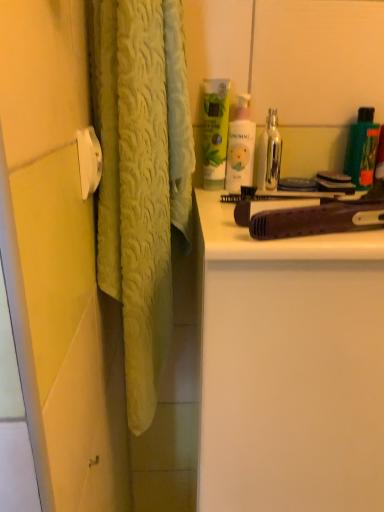
Image resolution: width=384 pixels, height=512 pixels. What do you see at coordinates (276, 240) in the screenshot? I see `brown wood comb at upper right` at bounding box center [276, 240].

This screenshot has width=384, height=512. Describe the element at coordinates (368, 156) in the screenshot. I see `green plastic bottle at upper right, arranged as the 1th toiletry when viewed from the right` at that location.

Measure the distance between green matte bottle at upper right, which ranks as the 2th mouthwash in left-to-right order, and camera.

A distance of 28.73 inches exists between green matte bottle at upper right, which ranks as the 2th mouthwash in left-to-right order, and camera.

What is the approximate height of green matte bottle at upper right, which ranks as the 2th mouthwash in left-to-right order?

green matte bottle at upper right, which ranks as the 2th mouthwash in left-to-right order, is 6.19 inches tall.

In order to face pink matte lotion at upper center, marked as the first toiletry in a left-to-right arrangement, should I rotate leftwards or rightwards?

To face it directly, rotate right by 6.670 degrees.

This screenshot has width=384, height=512. I want to click on metallic silver mouthwash at upper right, arranged as the 1th mouthwash when viewed from the left, so click(x=269, y=154).

This screenshot has height=512, width=384. Identify the location of brown wood comb at upper right. [x=276, y=240].

Is metallic silver mouthwash at upper right, marked as the 2th mouthwash in a right-to-left arrangement, positioned beyond the bounds of green matte bottle at upper right, the first mouthwash when ordered from right to left?

Absolutely, metallic silver mouthwash at upper right, marked as the 2th mouthwash in a right-to-left arrangement, is external to green matte bottle at upper right, the first mouthwash when ordered from right to left.

Find the location of a particular element. mouthwash below the green matte bottle at upper right, which ranks as the 2th mouthwash in left-to-right order (from the image's perspective) is located at coordinates (269, 154).

Consider the image. Is the surface of metallic silver mouthwash at upper right, arranged as the 1th mouthwash when viewed from the left, in direct contact with green matte bottle at upper right, the first mouthwash when ordered from right to left?

No, metallic silver mouthwash at upper right, arranged as the 1th mouthwash when viewed from the left, is not making contact with green matte bottle at upper right, the first mouthwash when ordered from right to left.

Between metallic silver mouthwash at upper right, arranged as the 1th mouthwash when viewed from the left, and green matte bottle at upper right, the first mouthwash when ordered from right to left, which one has more height?

Standing taller between the two is green matte bottle at upper right, the first mouthwash when ordered from right to left.

From the image's perspective, does green plastic bottle at upper right, arranged as the 1th toiletry when viewed from the right, appear lower than green matte bottle at upper right, which ranks as the 2th mouthwash in left-to-right order?

Yes, from the image's perspective, green plastic bottle at upper right, arranged as the 1th toiletry when viewed from the right, is beneath green matte bottle at upper right, which ranks as the 2th mouthwash in left-to-right order.

Which object is positioned more to the right, green plastic bottle at upper right, the second toiletry viewed from the left, or green matte bottle at upper right, which ranks as the 2th mouthwash in left-to-right order?

green plastic bottle at upper right, the second toiletry viewed from the left, is more to the right.

The image size is (384, 512). Find the location of `toiletry below the green matte bottle at upper right, which ranks as the 2th mouthwash in left-to-right order (from a real-world perspective)`. toiletry below the green matte bottle at upper right, which ranks as the 2th mouthwash in left-to-right order (from a real-world perspective) is located at coordinates (368, 156).

Is brown wood comb at upper right not close to green matte lotion at upper center?

Actually, brown wood comb at upper right and green matte lotion at upper center are a little close together.

Which object is closer to the camera, brown wood comb at upper right or green matte lotion at upper center?

brown wood comb at upper right.

Is point (336, 257) less distant than point (204, 93)?

Yes, it is.

Considering the relative sizes of brown wood comb at upper right and green matte lotion at upper center in the image provided, is brown wood comb at upper right shorter than green matte lotion at upper center?

Indeed, brown wood comb at upper right has a lesser height compared to green matte lotion at upper center.

Based on the photo, is pink matte lotion at upper center, marked as the first toiletry in a left-to-right arrangement, surrounded by white matte cabinet at right?

No, pink matte lotion at upper center, marked as the first toiletry in a left-to-right arrangement, is not surrounded by white matte cabinet at right.

Is white matte cabinet at right taller than pink matte lotion at upper center, marked as the first toiletry in a left-to-right arrangement?

Result: Yes.

Could you tell me if white matte cabinet at right is turned towards pink matte lotion at upper center, which ranks as the second toiletry in right-to-left order?

No, white matte cabinet at right does not turn towards pink matte lotion at upper center, which ranks as the second toiletry in right-to-left order.

Looking at the image, does white matte cabinet at right seem bigger or smaller compared to pink matte lotion at upper center, which ranks as the second toiletry in right-to-left order?

Considering their sizes, white matte cabinet at right takes up more space than pink matte lotion at upper center, which ranks as the second toiletry in right-to-left order.

Would you consider brown wood comb at upper right to be distant from green plastic bottle at upper right, the second toiletry viewed from the left?

No.

Is brown wood comb at upper right oriented away from green plastic bottle at upper right, the second toiletry viewed from the left?

Yes, brown wood comb at upper right is facing away from green plastic bottle at upper right, the second toiletry viewed from the left.

How different are the orientations of brown wood comb at upper right and green plastic bottle at upper right, the second toiletry viewed from the left, in degrees?

There is a 2.06e-05-degree angle between the facing directions of brown wood comb at upper right and green plastic bottle at upper right, the second toiletry viewed from the left.

Can you confirm if brown wood comb at upper right is positioned to the right of green plastic bottle at upper right, arranged as the 1th toiletry when viewed from the right?

No, brown wood comb at upper right is not to the right of green plastic bottle at upper right, arranged as the 1th toiletry when viewed from the right.

Can green matte bottle at upper right, the first mouthwash when ordered from right to left, be found inside white matte cabinet at right?

Actually, green matte bottle at upper right, the first mouthwash when ordered from right to left, is outside white matte cabinet at right.

Is white matte cabinet at right behind green matte bottle at upper right, the first mouthwash when ordered from right to left?

That is False.

Are white matte cabinet at right and green matte bottle at upper right, the first mouthwash when ordered from right to left, located far from each other?

No.

Find the location of `the 2nd mouthwash behind the white matte cabinet at right, starting your count from the anchor`. the 2nd mouthwash behind the white matte cabinet at right, starting your count from the anchor is located at coordinates (362, 149).

Can you confirm if white matte cabinet at right is thinner than metallic silver mouthwash at upper right, marked as the 2th mouthwash in a right-to-left arrangement?

In fact, white matte cabinet at right might be wider than metallic silver mouthwash at upper right, marked as the 2th mouthwash in a right-to-left arrangement.

Is white matte cabinet at right shorter than metallic silver mouthwash at upper right, arranged as the 1th mouthwash when viewed from the left?

Incorrect, the height of white matte cabinet at right does not fall short of that of metallic silver mouthwash at upper right, arranged as the 1th mouthwash when viewed from the left.

From the image's perspective, which one is positioned higher, white matte cabinet at right or metallic silver mouthwash at upper right, marked as the 2th mouthwash in a right-to-left arrangement?

metallic silver mouthwash at upper right, marked as the 2th mouthwash in a right-to-left arrangement, is shown above in the image.

Could you tell me if white matte cabinet at right is turned towards metallic silver mouthwash at upper right, marked as the 2th mouthwash in a right-to-left arrangement?

No, white matte cabinet at right is not facing towards metallic silver mouthwash at upper right, marked as the 2th mouthwash in a right-to-left arrangement.

The height and width of the screenshot is (512, 384). I want to click on mouthwash located above the metallic silver mouthwash at upper right, marked as the 2th mouthwash in a right-to-left arrangement (from the image's perspective), so click(362, 149).

Locate an element on the screen. toiletry located below the green matte bottle at upper right, which ranks as the 2th mouthwash in left-to-right order (from the image's perspective) is located at coordinates (368, 156).

Looking at the image, which one is located closer to green matte lotion at upper center, green matte bottle at upper right, the first mouthwash when ordered from right to left, or brown wood comb at upper right?

brown wood comb at upper right lies closer to green matte lotion at upper center than the other object.

Based on their spatial positions, is metallic silver mouthwash at upper right, arranged as the 1th mouthwash when viewed from the left, or green matte lotion at upper center closer to green plastic bottle at upper right, arranged as the 1th toiletry when viewed from the right?

Among the two, metallic silver mouthwash at upper right, arranged as the 1th mouthwash when viewed from the left, is located nearer to green plastic bottle at upper right, arranged as the 1th toiletry when viewed from the right.

Which object lies nearer to the anchor point pink matte lotion at upper center, which ranks as the second toiletry in right-to-left order, green matte lotion at upper center or green matte bottle at upper right, which ranks as the 2th mouthwash in left-to-right order?

Among the two, green matte lotion at upper center is located nearer to pink matte lotion at upper center, which ranks as the second toiletry in right-to-left order.

Estimate the real-world distances between objects in this image. Which object is further from green plastic bottle at upper right, arranged as the 1th toiletry when viewed from the right, white matte cabinet at right or green matte bottle at upper right, the first mouthwash when ordered from right to left?

white matte cabinet at right lies further to green plastic bottle at upper right, arranged as the 1th toiletry when viewed from the right, than the other object.

Considering their positions, is metallic silver mouthwash at upper right, arranged as the 1th mouthwash when viewed from the left, positioned closer to brown wood comb at upper right than white matte cabinet at right?

white matte cabinet at right.

Considering their positions, is green matte bottle at upper right, the first mouthwash when ordered from right to left, positioned closer to brown wood comb at upper right than white matte cabinet at right?

white matte cabinet at right lies closer to brown wood comb at upper right than the other object.

When comparing their distances from metallic silver mouthwash at upper right, arranged as the 1th mouthwash when viewed from the left, does white matte cabinet at right or green matte lotion at upper center seem further?

Based on the image, white matte cabinet at right appears to be further to metallic silver mouthwash at upper right, arranged as the 1th mouthwash when viewed from the left.

In the scene shown: Considering their positions, is metallic silver mouthwash at upper right, marked as the 2th mouthwash in a right-to-left arrangement, positioned further to green matte lotion at upper center than pink matte lotion at upper center, which ranks as the second toiletry in right-to-left order?

Based on the image, metallic silver mouthwash at upper right, marked as the 2th mouthwash in a right-to-left arrangement, appears to be further to green matte lotion at upper center.

Where is `mouthwash between green matte lotion at upper center and green matte bottle at upper right, which ranks as the 2th mouthwash in left-to-right order`? mouthwash between green matte lotion at upper center and green matte bottle at upper right, which ranks as the 2th mouthwash in left-to-right order is located at coordinates (269, 154).

At what (x,y) coordinates should I click in order to perform the action: click on toiletry between metallic silver mouthwash at upper right, arranged as the 1th mouthwash when viewed from the left, and white matte cabinet at right in the up-down direction. Please return your answer as a coordinate pair (x, y). Image resolution: width=384 pixels, height=512 pixels. Looking at the image, I should click on (368, 156).

Where is `toiletry positioned between brown wood comb at upper right and green matte bottle at upper right, which ranks as the 2th mouthwash in left-to-right order, from near to far`? toiletry positioned between brown wood comb at upper right and green matte bottle at upper right, which ranks as the 2th mouthwash in left-to-right order, from near to far is located at coordinates (240, 146).

In order to click on toiletry between green matte lotion at upper center and green plastic bottle at upper right, the second toiletry viewed from the left in this screenshot , I will do `click(240, 146)`.